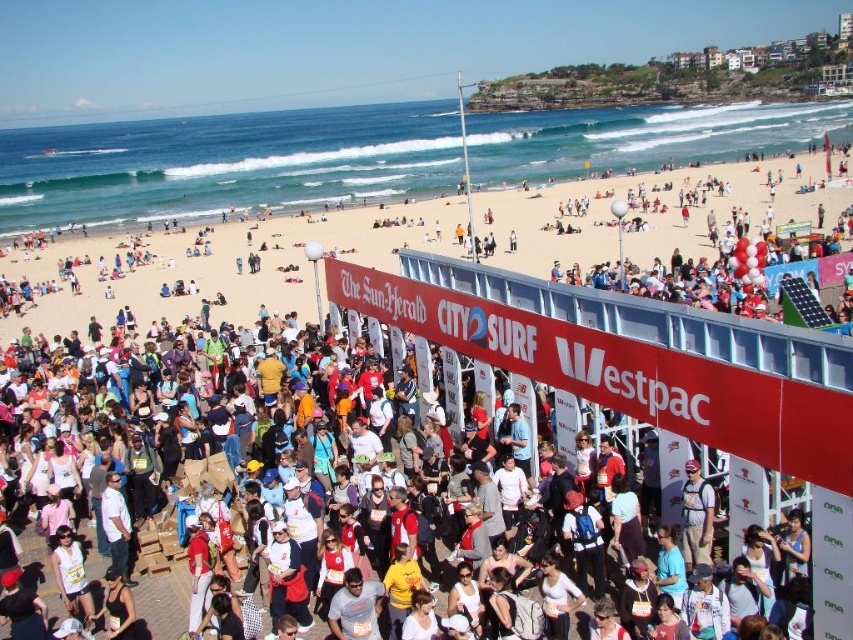
You are a photographer standing at the edge of the white sand beach at upper center. You want to capture a photo of the white cotton crowd at center. In which direction should you move to frame them properly?

The white cotton crowd at center is positioned on the left side of white sand beach at upper center. To frame them properly, you should move to the left side of the white sand beach at upper center.

You are a participant in the beach event and need to reach the registration desk located at point (572, 253). There is an obstacle at point (302, 548). Can you safely walk around the obstacle to reach the desk?

Point (302, 548) is in front of point (572, 253), so the obstacle is blocking the path to the registration desk. You need to find an alternative route to avoid the obstacle and reach the desk.

You are a photographer positioned at the origin point of the coordinate system. You need to capture a photo of the white cotton crowd at center. What are the coordinates where you should aim your camera?

The white cotton crowd at center is located at coordinates point (210, 481), so you should aim your camera at those coordinates to capture the crowd.